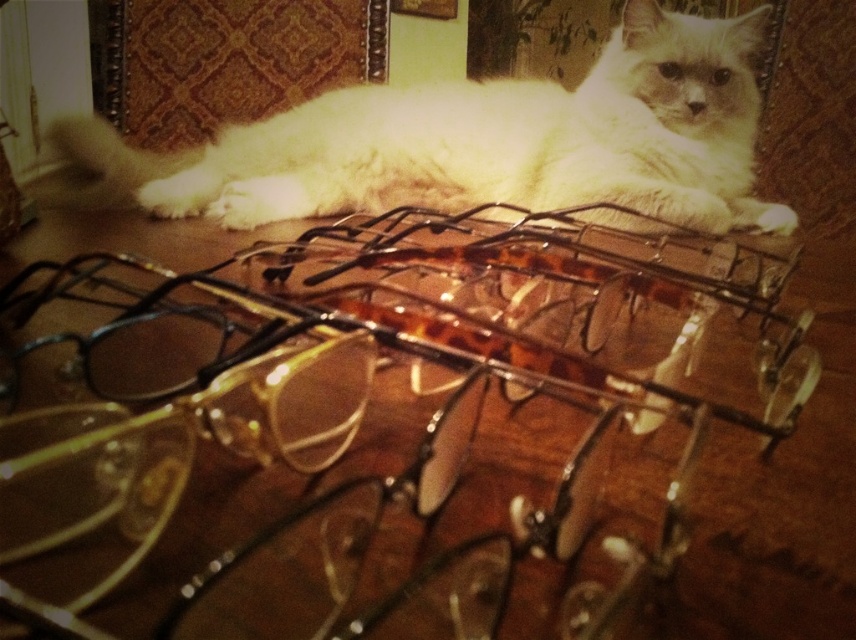
You are trying to decide whether to place a small decorative item on the transparent plastic glasses at center without crushing them. Considering their size relative to the white fluffy cat at upper center, can you estimate if the glasses are large enough to support the item?

The transparent plastic glasses at center has a smaller size compared to the white fluffy cat at upper center. Since the glasses are smaller than the cat, they may not be able to support the weight of the item safely. It would be better to choose a sturdier surface.

You are a delivery robot with a height of 24 inches. You need to move from the transparent plastic glasses at center to the white fluffy cat at upper center. Can you pass through the space between them without bending down?

The distance between the transparent plastic glasses at center and the white fluffy cat at upper center is 23.69 inches. Since the robot is 24 inches tall, it cannot pass through the space without bending down because the available vertical clearance is less than its height.